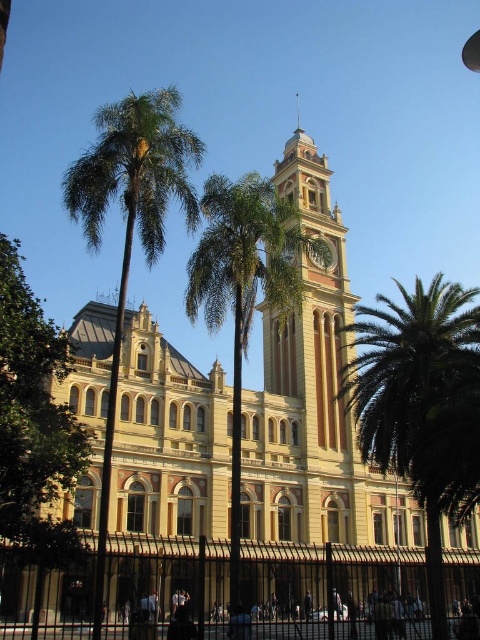
Question: Can you confirm if green leafy palm tree at left is smaller than light brown stone clock tower at center?

Choices:
 (A) no
 (B) yes

Answer: (A)

Question: Which object appears closest to the camera in this image?

Choices:
 (A) light brown stone clock tower at center
 (B) green leafy palm tree at left
 (C) green leafy tree at left
 (D) green leafy palm at right

Answer: (B)

Question: Which of the following is the farthest from the observer?

Choices:
 (A) (151, 131)
 (B) (320, 248)

Answer: (B)

Question: Does green leafy palm at right lie in front of light brown stone clock tower at center?

Choices:
 (A) yes
 (B) no

Answer: (A)

Question: Is green leafy tree at left behind green leafy palm at center?

Choices:
 (A) yes
 (B) no

Answer: (B)

Question: Which of the following is the closest to the observer?

Choices:
 (A) green leafy tree at left
 (B) green leafy palm at center
 (C) green leafy palm at right

Answer: (A)